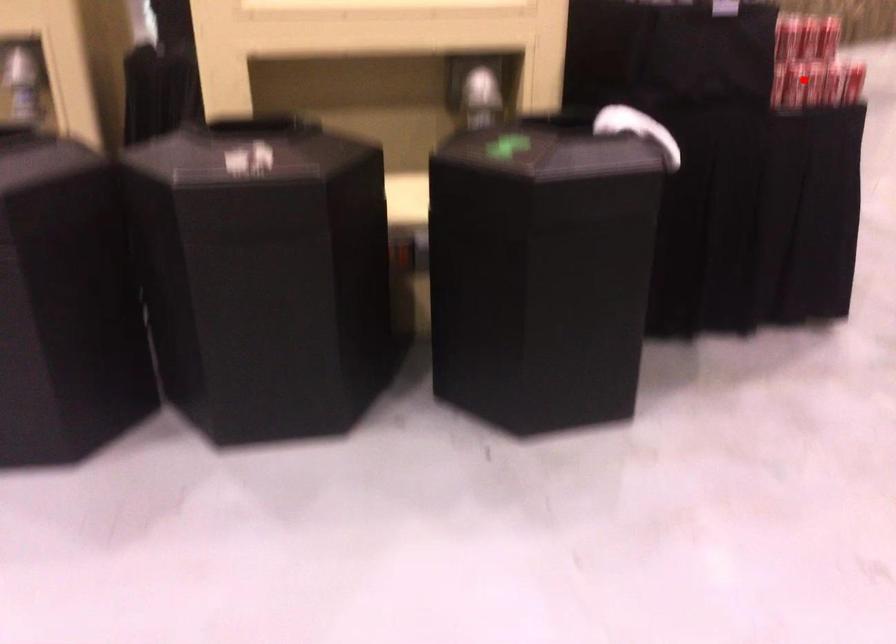
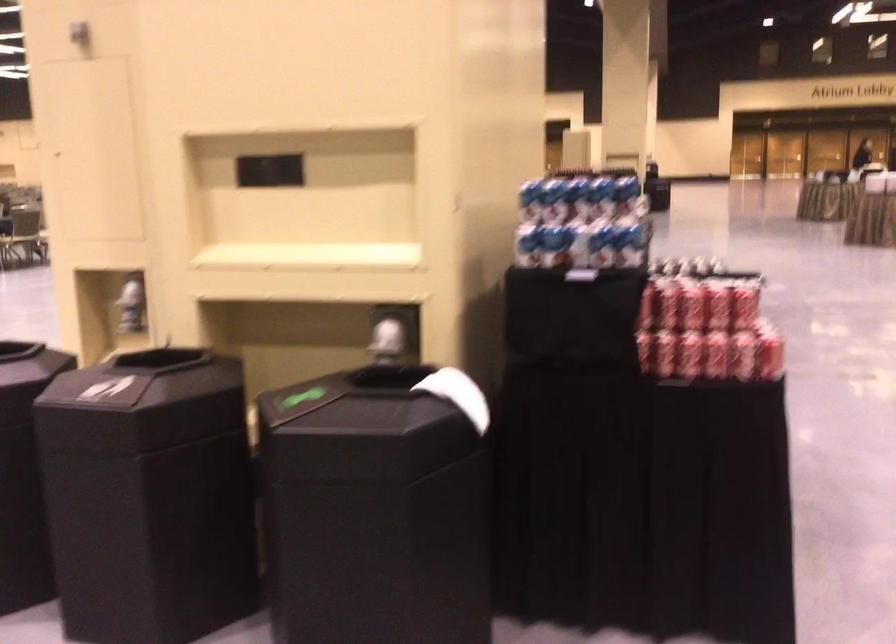
In the second image, find the point that corresponds to the highlighted location in the first image.

(688, 355)